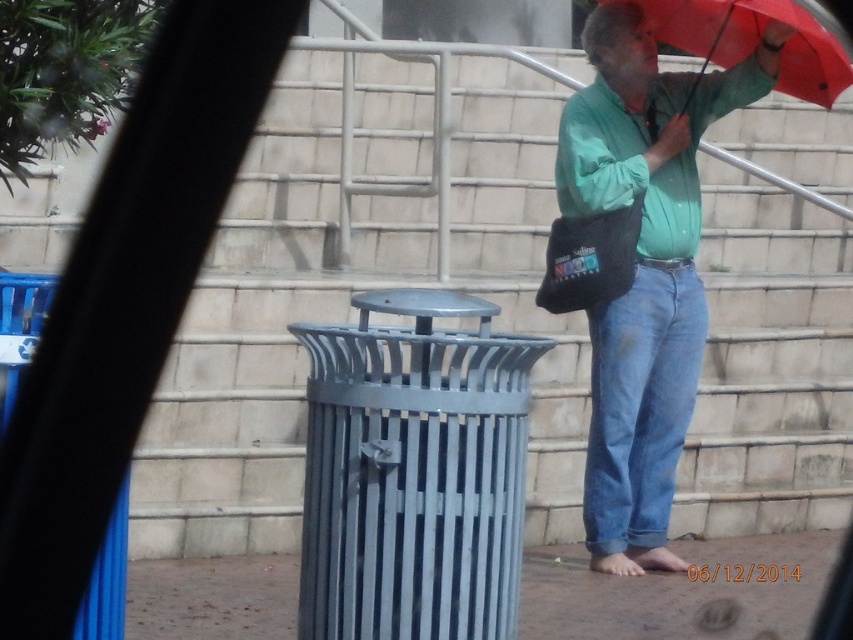
You are standing at the base of the stairs and want to walk up to the top. The stairs are marked by the point at coordinates (360, 276). How many steps are there between you and the top?

The point at coordinates (360, 276) marks the gray concrete stairs at center, but the exact number of steps isn not specified in the provided information. Therefore, I cannot determine the number of steps between you and the top.

You are trying to locate the gray concrete stairs at center in the image. What are their coordinates?

The gray concrete stairs at center are located at coordinates point (360, 276).

You are standing at the position of the person in the image and want to pick up an item located at point (735, 20). Which direction should you move to reach it first without moving past point (743, 212)?

You should move backward because point (743, 212) is closer to you than point (735, 20), so moving backward will allow you to reach point (735, 20) before passing point (743, 212).